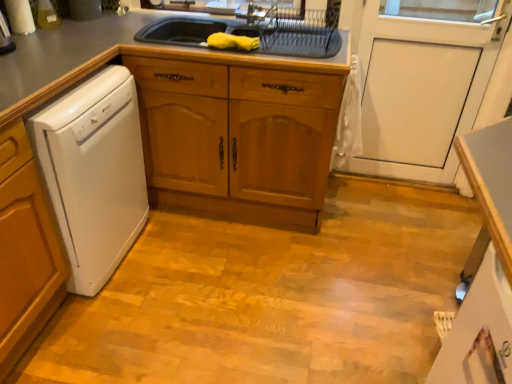
Question: Considering the relative sizes of gray matte countertop at upper center and white matte door at center in the image provided, is gray matte countertop at upper center taller than white matte door at center?

Choices:
 (A) yes
 (B) no

Answer: (B)

Question: Is gray matte countertop at upper center positioned far away from white matte door at center?

Choices:
 (A) yes
 (B) no

Answer: (B)

Question: From a real-world perspective, does gray matte countertop at upper center stand above white matte door at center?

Choices:
 (A) no
 (B) yes

Answer: (A)

Question: Is gray matte countertop at upper center shorter than white matte door at center?

Choices:
 (A) no
 (B) yes

Answer: (B)

Question: Does gray matte countertop at upper center have a lesser width compared to white matte door at center?

Choices:
 (A) yes
 (B) no

Answer: (B)

Question: Does gray matte countertop at upper center have a larger size compared to white matte door at center?

Choices:
 (A) no
 (B) yes

Answer: (B)

Question: Does metallic silver faucet at upper center have a lesser height compared to white matte door at center?

Choices:
 (A) no
 (B) yes

Answer: (B)

Question: Would you say metallic silver faucet at upper center is a long distance from white matte door at center?

Choices:
 (A) no
 (B) yes

Answer: (A)

Question: Is metallic silver faucet at upper center thinner than white matte door at center?

Choices:
 (A) no
 (B) yes

Answer: (A)

Question: From the image's perspective, is metallic silver faucet at upper center on white matte door at center?

Choices:
 (A) yes
 (B) no

Answer: (A)

Question: Is metallic silver faucet at upper center looking in the opposite direction of white matte door at center?

Choices:
 (A) yes
 (B) no

Answer: (B)

Question: Is metallic silver faucet at upper center at the left side of white matte door at center?

Choices:
 (A) no
 (B) yes

Answer: (B)

Question: Is gray matte countertop at upper center turned away from white glossy counter at lower right?

Choices:
 (A) yes
 (B) no

Answer: (B)